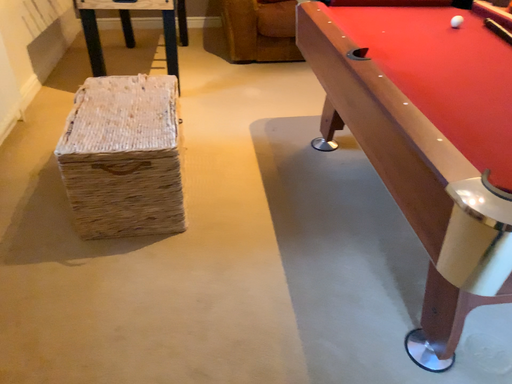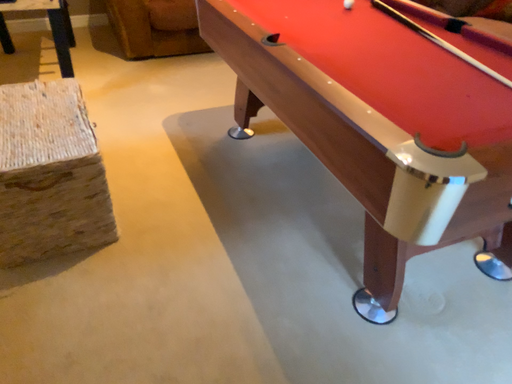
Question: Which way did the camera rotate in the video?

Choices:
 (A) rotated right
 (B) rotated left

Answer: (A)